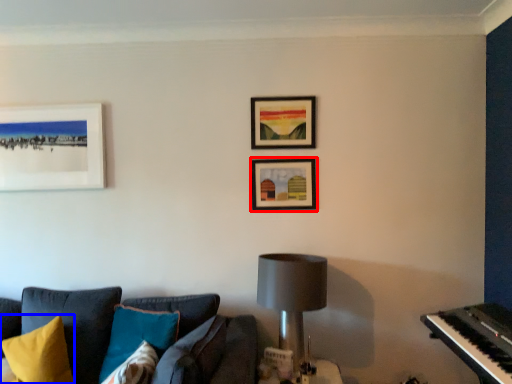
Question: Among these objects, which one is nearest to the camera, picture frame (highlighted by a red box) or pillow (highlighted by a blue box)?

Choices:
 (A) picture frame
 (B) pillow

Answer: (B)